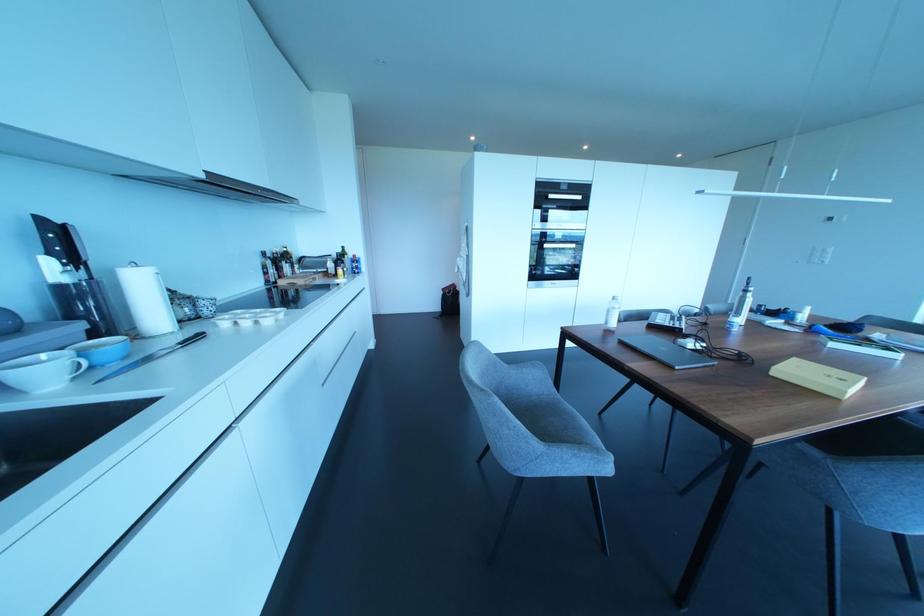
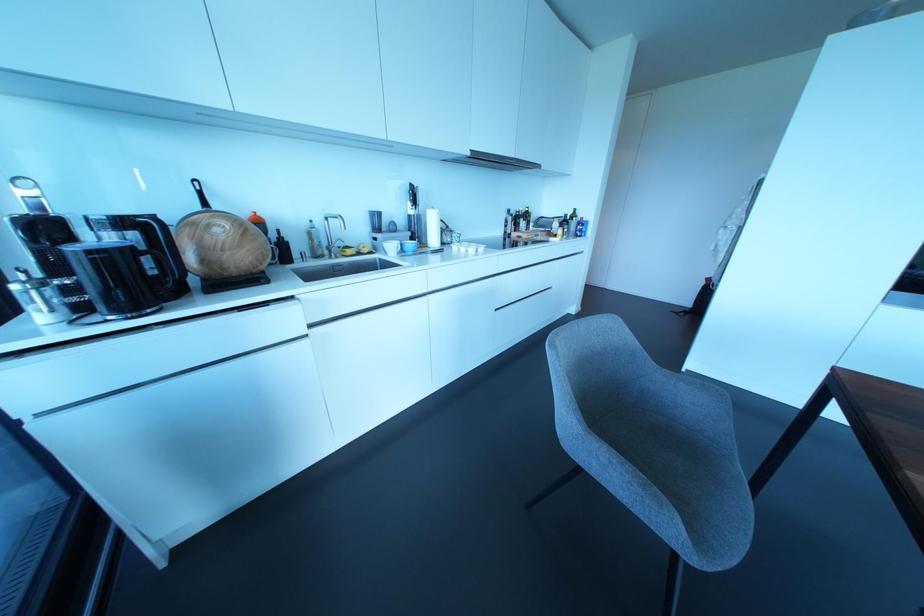
Locate, in the second image, the point that corresponds to [281,315] in the first image.

(480, 249)